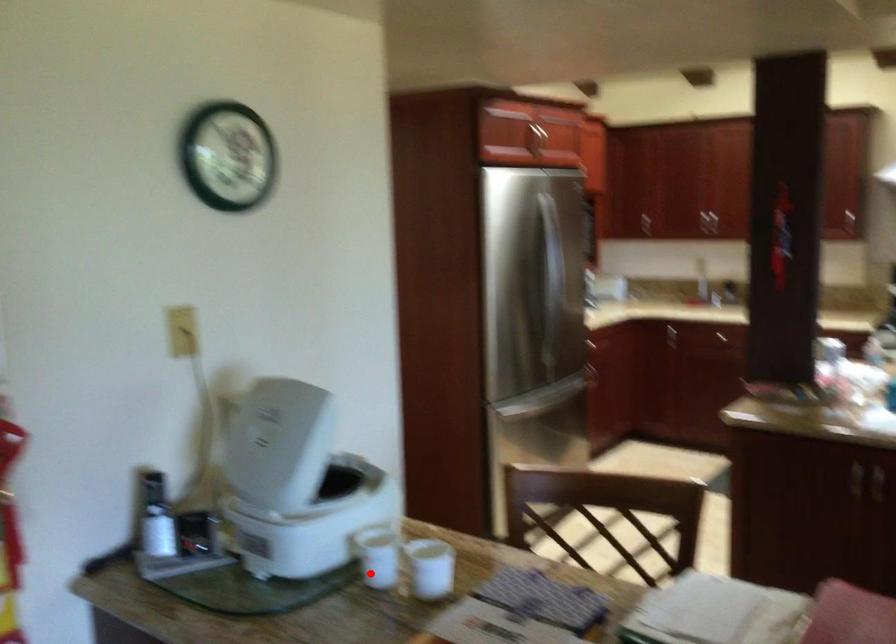
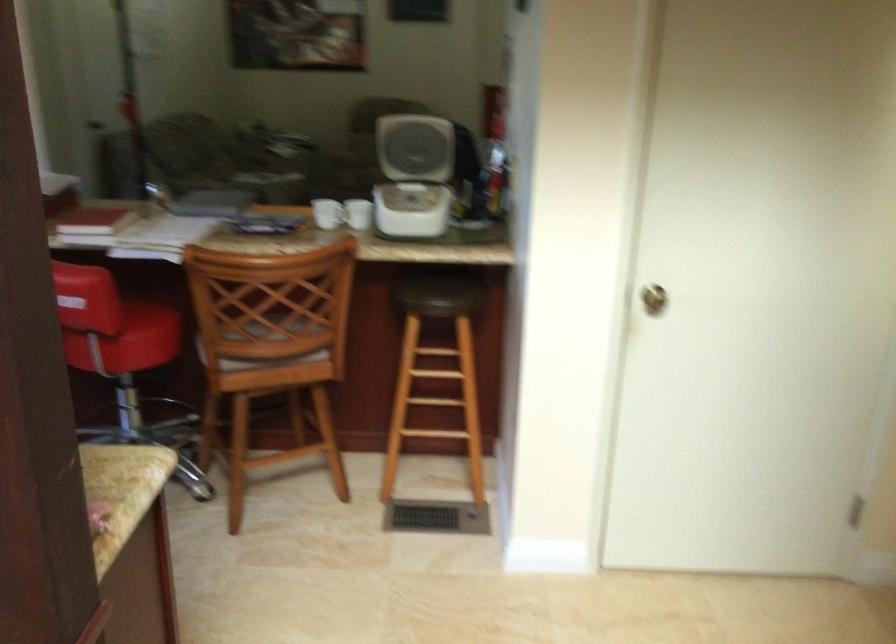
Find the pixel in the second image that matches the highlighted location in the first image.

(358, 214)